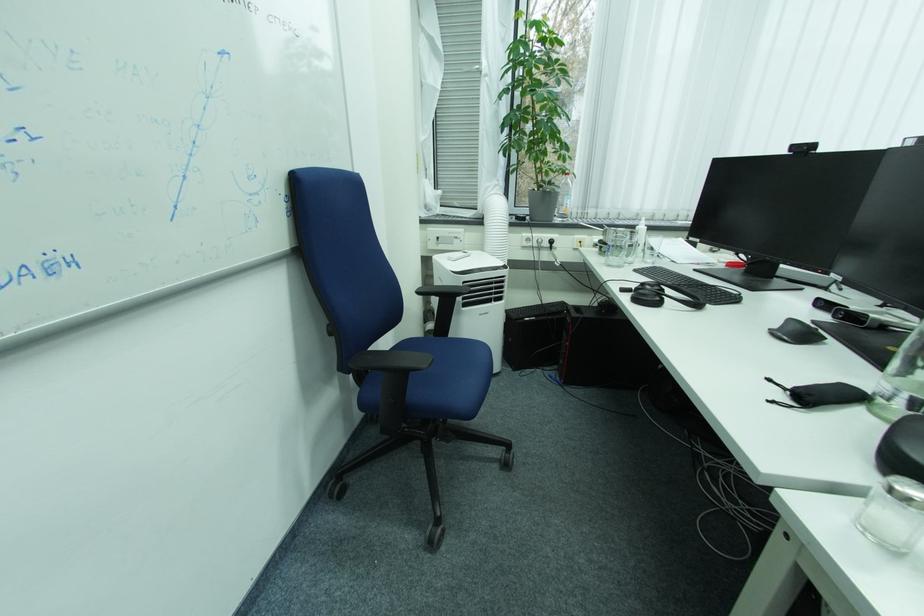
Where is `grey plant pot`? The image size is (924, 616). grey plant pot is located at coordinates (x=536, y=113).